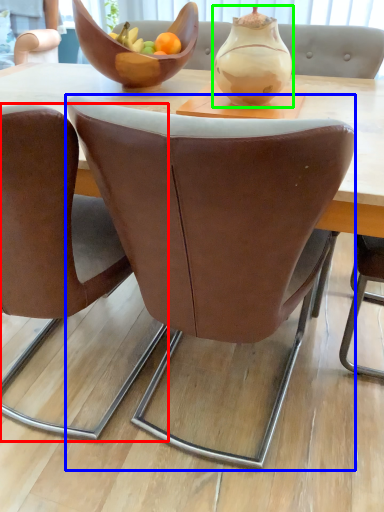
Question: Which is nearer to the chair (highlighted by a red box)? chair (highlighted by a blue box) or vase (highlighted by a green box).

Choices:
 (A) chair
 (B) vase

Answer: (A)